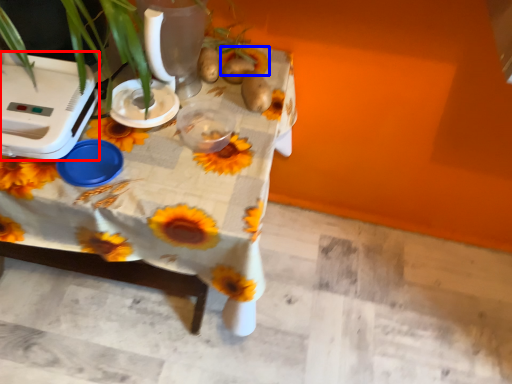
Question: Which of the following is the farthest to the observer, appliance (highlighted by a red box) or flower (highlighted by a blue box)?

Choices:
 (A) appliance
 (B) flower

Answer: (B)